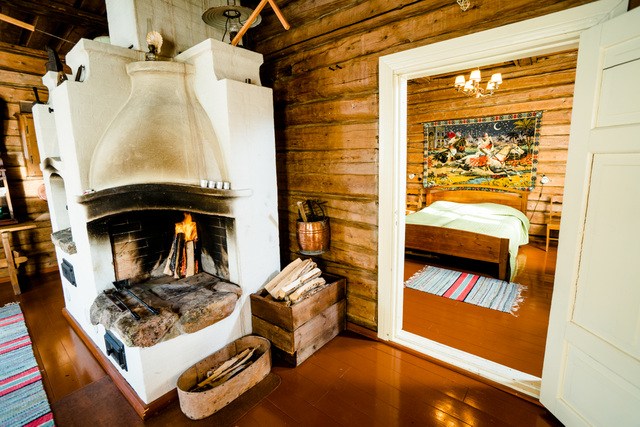
I want to click on rag rug, so click(x=444, y=283).